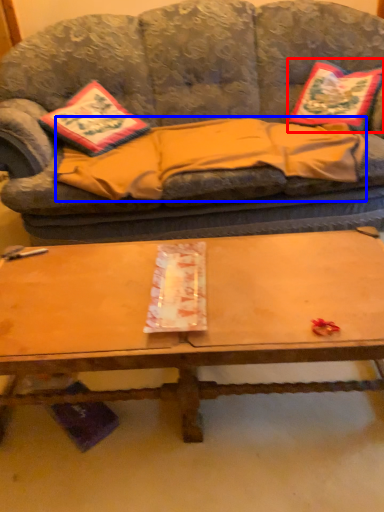
Question: Which object appears farthest to the camera in this image, pillow (highlighted by a red box) or blanket (highlighted by a blue box)?

Choices:
 (A) pillow
 (B) blanket

Answer: (A)